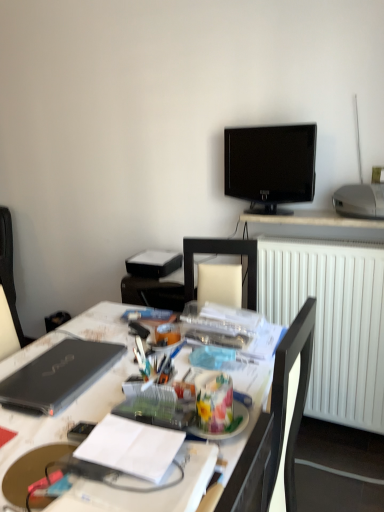
Locate an element on the screen. Image resolution: width=384 pixels, height=512 pixels. free space above black matte laptop at left (from a real-world perspective) is located at coordinates 57,365.